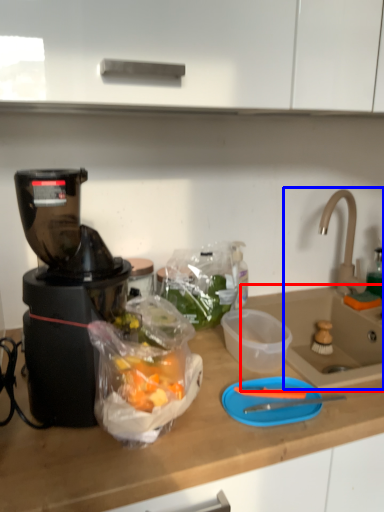
Question: Which point is further to the camera, sink (highlighted by a red box) or sink (highlighted by a blue box)?

Choices:
 (A) sink
 (B) sink

Answer: (B)